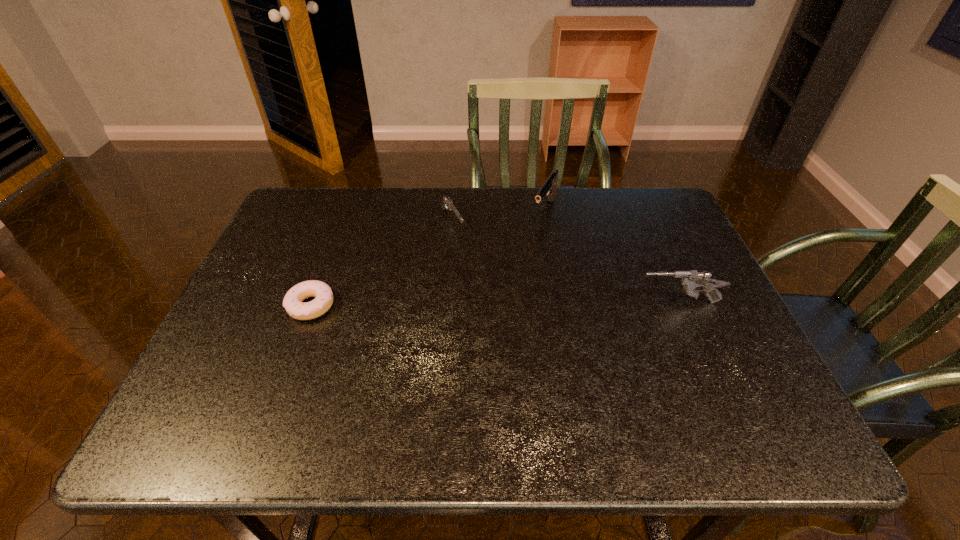
Find the location of a particular element. The width and height of the screenshot is (960, 540). free space on the desktop that is between the shortest object and the gun and is positioned on the front-facing side of the second shortest object is located at coordinates (506, 304).

Find the location of a particular element. vacant space on the desktop that is between the leftmost object and the gun and is positioned at the muzzle of the taller pistol is located at coordinates (485, 304).